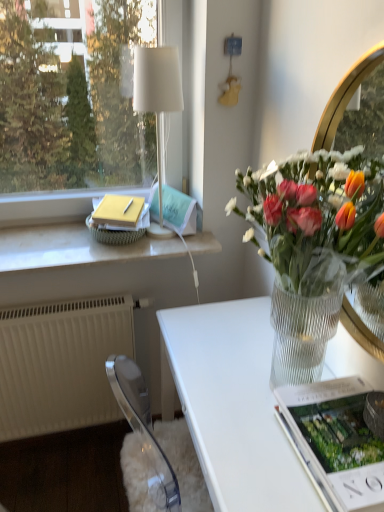
The image size is (384, 512). I want to click on vacant point to the left of matte white magazine at lower right, which is the first magazine in bottom-to-top order, so click(x=248, y=436).